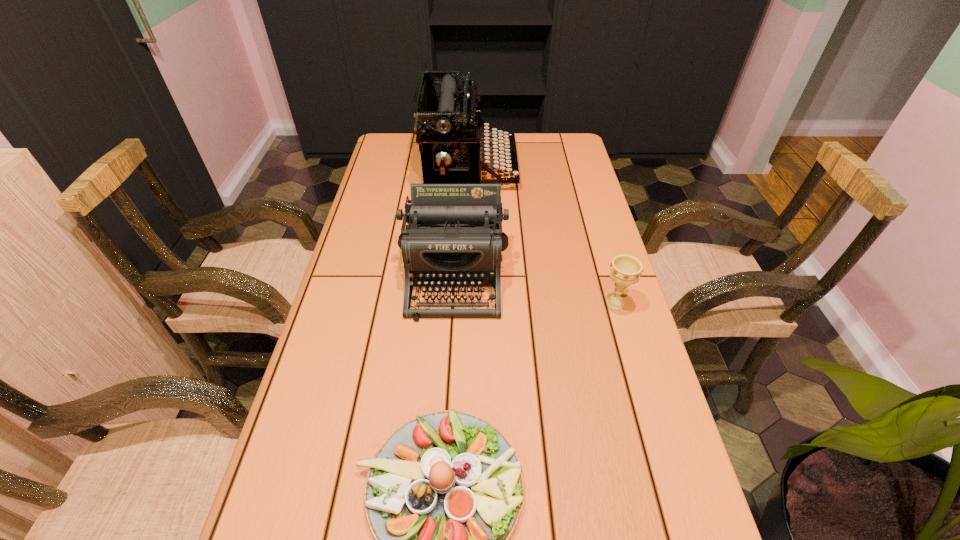
Identify the location of object that is at the right edge. The height and width of the screenshot is (540, 960). (625, 269).

In the image, there is a desktop. Where is `blank space at the far edge`? blank space at the far edge is located at coordinates (492, 154).

Find the location of a particular element. This screenshot has width=960, height=540. vacant position at the left edge of the desktop is located at coordinates [351, 273].

Identify the location of vacant point at the right edge. The width and height of the screenshot is (960, 540). tap(596, 380).

Where is `free space at the far left corner`? The image size is (960, 540). free space at the far left corner is located at coordinates (396, 165).

Locate an element on the screen. The height and width of the screenshot is (540, 960). vacant space at the far right corner is located at coordinates (572, 151).

This screenshot has height=540, width=960. In order to click on vacant point located between the taller typewriter and the second shortest object in this screenshot , I will do `click(542, 235)`.

This screenshot has width=960, height=540. I want to click on vacant area that lies between the second shortest object and the third shortest object, so click(535, 289).

Where is `object that is the closest to the third shortest object`? object that is the closest to the third shortest object is located at coordinates (451, 121).

Where is `object that ranks as the second closest to the third tallest object`? object that ranks as the second closest to the third tallest object is located at coordinates (443, 494).